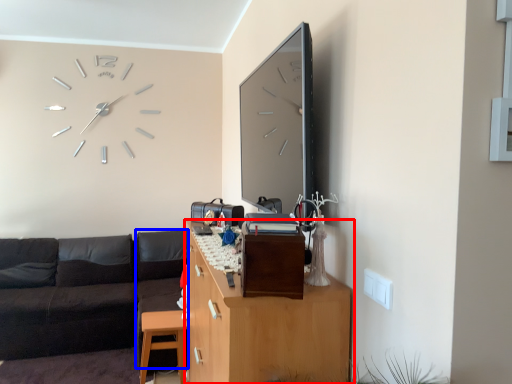
Question: Among these objects, which one is farthest to the camera, cabinetry (highlighted by a red box) or couch (highlighted by a blue box)?

Choices:
 (A) cabinetry
 (B) couch

Answer: (B)